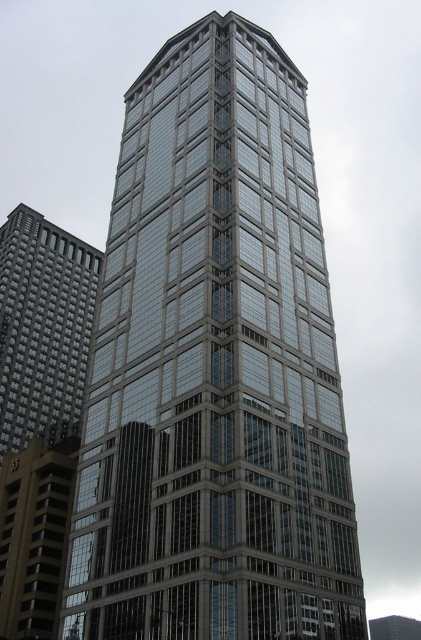
You are an architect evaluating the skyline of a city. You notice the glassy steel tower at center and the matte gray building at left. Which structure has a larger footprint in terms of its base area?

The glassy steel tower at center has a larger footprint than the matte gray building at left because it is bigger in size.

Consider the image. You are a drone operator tasked with flying a drone between the glassy steel tower at center and the matte gray building at left. The drone has a maximum flight distance of 60 meters. Can the drone safely complete the flight between these two structures without exceeding its range?

The glassy steel tower at center and the matte gray building at left are 63.52 meters apart, which exceeds the drone operator drone maximum flight distance of 60 meters. Therefore, the drone cannot safely complete the flight between these two structures without exceeding its range.

You are an architect analyzing the layout of the city skyline. You notice the glassy steel tower at center and the matte gray building at left. Which structure is situated higher in the image?

The glassy steel tower at center is positioned over the matte gray building at left, meaning it is higher in the image.